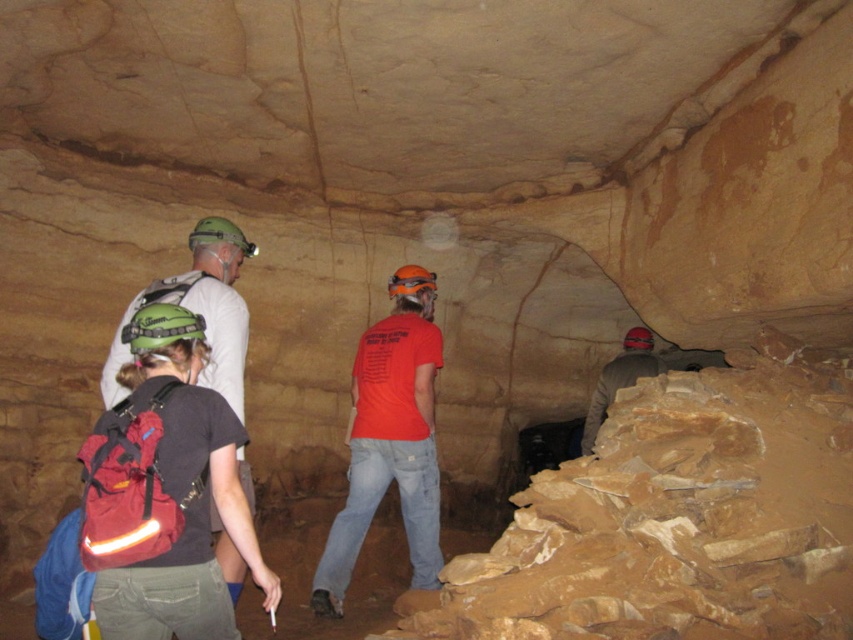
Can you confirm if orange fabric shirt at center is positioned above matte green helmet at upper left?

No, orange fabric shirt at center is not above matte green helmet at upper left.

Does orange fabric shirt at center appear on the right side of matte green helmet at upper left?

Yes, orange fabric shirt at center is to the right of matte green helmet at upper left.

Where is `orange fabric shirt at center`? orange fabric shirt at center is located at coordinates (390, 440).

What are the coordinates of `orange fabric shirt at center` in the screenshot? It's located at (390, 440).

Can you confirm if orange fabric shirt at center is shorter than matte gray jacket at right?

In fact, orange fabric shirt at center may be taller than matte gray jacket at right.

Between point (418, 420) and point (598, 426), which one is positioned behind?

The point (598, 426) is behind.

Image resolution: width=853 pixels, height=640 pixels. I want to click on orange fabric shirt at center, so click(x=390, y=440).

Is matte green helmet at upper left bigger than matte gray jacket at right?

Indeed, matte green helmet at upper left has a larger size compared to matte gray jacket at right.

Which is behind, point (109, 403) or point (630, 337)?

The point (630, 337) is behind.

At what (x,y) coordinates should I click in order to perform the action: click on matte green helmet at upper left. Please return your answer as a coordinate pair (x, y). This screenshot has height=640, width=853. Looking at the image, I should click on (199, 310).